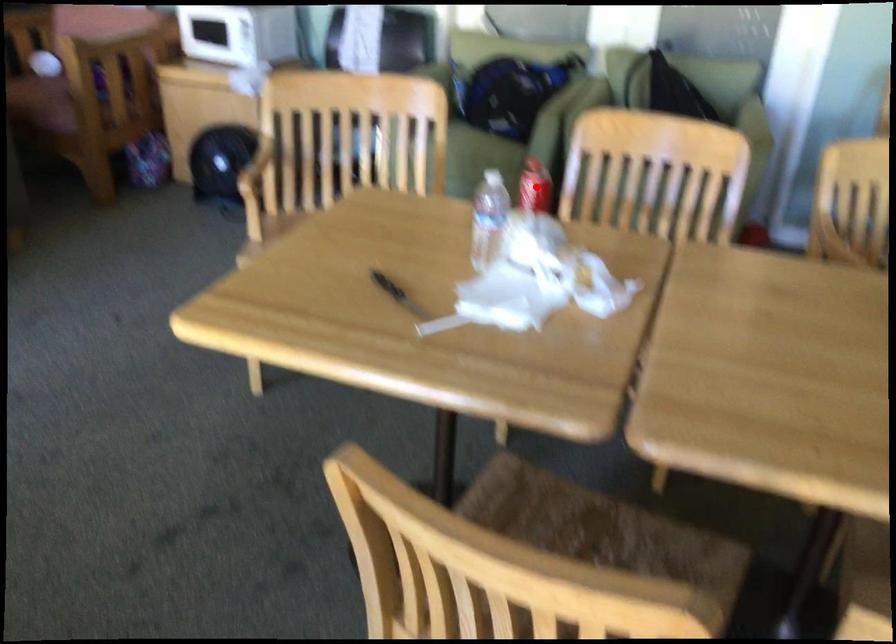
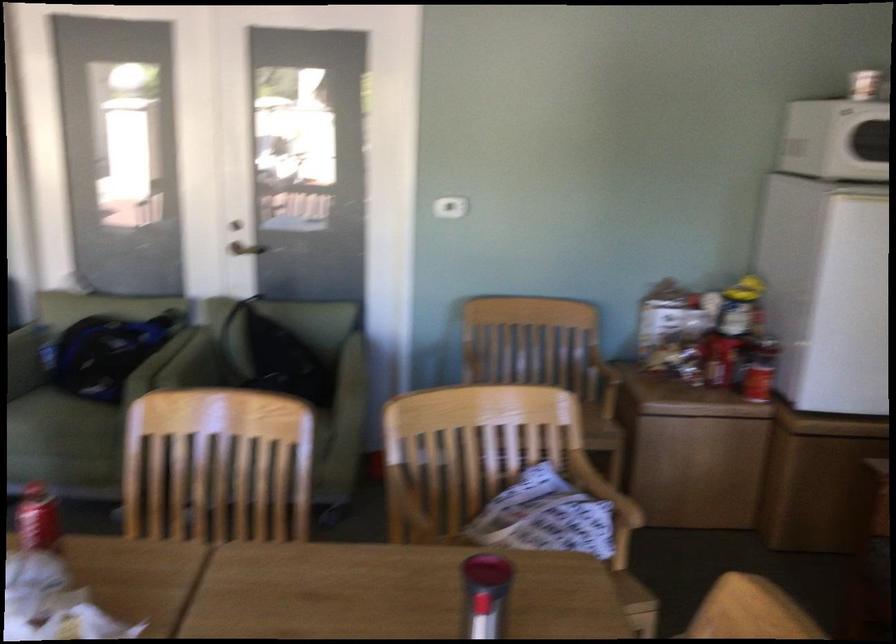
Question: I am providing you with two images of the same scene from different viewpoints. Image1 has a red point marked. In image2, the corresponding 3D location appears at what relative position? Reply with the corresponding letter.

Choices:
 (A) Closer
 (B) Farther

Answer: (A)